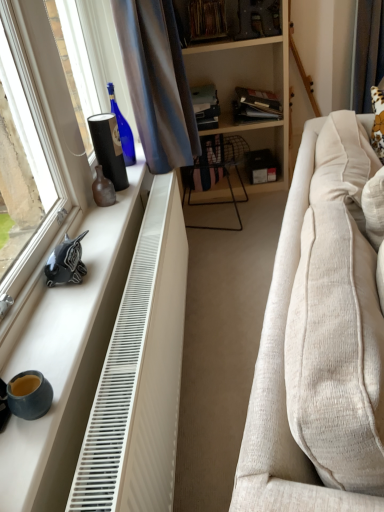
Measure the distance between brown fabric curtain at upper right, acting as the second curtain starting from the front, and camera.

The distance of brown fabric curtain at upper right, acting as the second curtain starting from the front, from camera is 9.74 feet.

Where is `hardcover book at center, which appears as the 1th book when viewed from the left`? This screenshot has width=384, height=512. hardcover book at center, which appears as the 1th book when viewed from the left is located at coordinates (205, 106).

From the picture: In order to face white matte window sill at left, should I rotate leftwards or rightwards?

Rotate your view left by about 12.907°.

The height and width of the screenshot is (512, 384). What do you see at coordinates (103, 189) in the screenshot?
I see `brown matte vase at left` at bounding box center [103, 189].

This screenshot has height=512, width=384. I want to click on brown fabric curtain at upper right, which is the 1th curtain in right-to-left order, so click(367, 53).

From the image's perspective, is brown fabric curtain at upper right, which is the 1th curtain in right-to-left order, above beige fabric couch at right?

Correct, brown fabric curtain at upper right, which is the 1th curtain in right-to-left order, appears higher than beige fabric couch at right in the image.

Is brown fabric curtain at upper right, acting as the second curtain starting from the front, turned away from beige fabric couch at right?

brown fabric curtain at upper right, acting as the second curtain starting from the front, is not turned away from beige fabric couch at right.

Is the depth of brown fabric curtain at upper right, which is the second curtain from left to right, greater than that of beige fabric couch at right?

Yes, brown fabric curtain at upper right, which is the second curtain from left to right, is further from the viewer.

Looking at this image, considering the relative positions of brown matte vase at left and white plastic radiator at lower left in the image provided, is brown matte vase at left to the right of white plastic radiator at lower left from the viewer's perspective?

In fact, brown matte vase at left is to the left of white plastic radiator at lower left.

Between brown matte vase at left and white plastic radiator at lower left, which one has larger size?

Bigger between the two is white plastic radiator at lower left.

Can you tell me how much brown matte vase at left and white plastic radiator at lower left differ in facing direction?

There is a 3.98-degree angle between the facing directions of brown matte vase at left and white plastic radiator at lower left.

Which is behind, brown matte vase at left or white plastic radiator at lower left?

brown matte vase at left is more distant.

From the image's perspective, which is above, hardcover book at center, which appears as the 1th book when viewed from the left, or matte black folder at upper center, positioned as the 3th book in left-to-right order?

matte black folder at upper center, positioned as the 3th book in left-to-right order, is shown above in the image.

What's the angular difference between hardcover book at center, which appears as the 1th book when viewed from the left, and matte black folder at upper center, the 1th book viewed from the right,'s facing directions?

The angular difference between hardcover book at center, which appears as the 1th book when viewed from the left, and matte black folder at upper center, the 1th book viewed from the right, is 0.000143 degrees.

Considering the sizes of objects hardcover book at center, which is counted as the 3th book, starting from the right, and matte black folder at upper center, positioned as the 3th book in left-to-right order, in the image provided, who is wider, hardcover book at center, which is counted as the 3th book, starting from the right, or matte black folder at upper center, positioned as the 3th book in left-to-right order,?

hardcover book at center, which is counted as the 3th book, starting from the right.

Does hardcover book at center, which is counted as the 3th book, starting from the right, touch black glossy unicorn at left?

There is a gap between hardcover book at center, which is counted as the 3th book, starting from the right, and black glossy unicorn at left.

Between hardcover book at center, which appears as the 1th book when viewed from the left, and black glossy unicorn at left, which one appears on the right side from the viewer's perspective?

hardcover book at center, which appears as the 1th book when viewed from the left, is more to the right.

Considering the relative sizes of hardcover book at center, which appears as the 1th book when viewed from the left, and black glossy unicorn at left in the image provided, is hardcover book at center, which appears as the 1th book when viewed from the left, smaller than black glossy unicorn at left?

No, hardcover book at center, which appears as the 1th book when viewed from the left, is not smaller than black glossy unicorn at left.

From a real-world perspective, who is located lower, hardcover book at center, which appears as the 1th book when viewed from the left, or black glossy unicorn at left?

In real-world perspective, hardcover book at center, which appears as the 1th book when viewed from the left, is lower.

Is matte black folder at upper center, the 1th book viewed from the right, facing towards hardcover book at center, which appears as the 1th book when viewed from the left?

No, matte black folder at upper center, the 1th book viewed from the right, is not oriented towards hardcover book at center, which appears as the 1th book when viewed from the left.

From a real-world perspective, does matte black folder at upper center, positioned as the 3th book in left-to-right order, sit lower than hardcover book at center, which is counted as the 3th book, starting from the right?

Yes, from a real-world perspective, matte black folder at upper center, positioned as the 3th book in left-to-right order, is beneath hardcover book at center, which is counted as the 3th book, starting from the right.

Considering the relative positions of matte black folder at upper center, the 1th book viewed from the right, and hardcover book at center, which appears as the 1th book when viewed from the left, in the image provided, is matte black folder at upper center, the 1th book viewed from the right, to the right of hardcover book at center, which appears as the 1th book when viewed from the left, from the viewer's perspective?

Correct, you'll find matte black folder at upper center, the 1th book viewed from the right, to the right of hardcover book at center, which appears as the 1th book when viewed from the left.

Consider the image. Looking at the image, does matte blue coffee cup at lower left seem bigger or smaller compared to matte black folder at upper center, positioned as the 3th book in left-to-right order?

In the image, matte blue coffee cup at lower left appears to be smaller than matte black folder at upper center, positioned as the 3th book in left-to-right order.

Measure the distance from matte blue coffee cup at lower left to matte black folder at upper center, the 1th book viewed from the right.

They are 8.32 feet apart.

From the image's perspective, is matte blue coffee cup at lower left above or below matte black folder at upper center, the 1th book viewed from the right?

From the image's perspective, matte blue coffee cup at lower left appears below matte black folder at upper center, the 1th book viewed from the right.

Considering the sizes of matte blue coffee cup at lower left and matte black folder at upper center, the 1th book viewed from the right, in the image, is matte blue coffee cup at lower left taller or shorter than matte black folder at upper center, the 1th book viewed from the right,?

matte blue coffee cup at lower left is shorter than matte black folder at upper center, the 1th book viewed from the right.

Are beige fabric couch at right and black glossy unicorn at left making contact?

beige fabric couch at right and black glossy unicorn at left are clearly separated.

Considering the sizes of beige fabric couch at right and black glossy unicorn at left in the image, is beige fabric couch at right taller or shorter than black glossy unicorn at left?

Clearly, beige fabric couch at right is taller compared to black glossy unicorn at left.

Looking at this image, which is more to the left, beige fabric couch at right or black glossy unicorn at left?

Answer: black glossy unicorn at left is more to the left.

Where is `curtain that is the 2nd object located behind the beige fabric couch at right`? This screenshot has width=384, height=512. curtain that is the 2nd object located behind the beige fabric couch at right is located at coordinates (367, 53).

Find the location of `vase above the white plastic radiator at lower left (from a real-world perspective)`. vase above the white plastic radiator at lower left (from a real-world perspective) is located at coordinates (103, 189).

Estimate the real-world distances between objects in this image. Which object is further from satin blue curtain at upper left, which is the first curtain in front-to-back order, beige fabric couch at right or brown fabric curtain at upper right, acting as the second curtain starting from the front?

brown fabric curtain at upper right, acting as the second curtain starting from the front, is positioned further to the anchor satin blue curtain at upper left, which is the first curtain in front-to-back order.

Looking at the image, which one is located closer to brown matte vase at left, matte blue coffee cup at lower left or hardcover book at center, which is counted as the 3th book, starting from the right?

Among the two, matte blue coffee cup at lower left is located nearer to brown matte vase at left.

Looking at the image, which one is located further to brown fabric curtain at upper right, acting as the second curtain starting from the front, brown matte vase at left or hardcover book at center, which is counted as the 3th book, starting from the right?

brown matte vase at left lies further to brown fabric curtain at upper right, acting as the second curtain starting from the front, than the other object.

Which object lies further to the anchor point black glossy unicorn at left, beige fabric couch at right or brown matte vase at left?

beige fabric couch at right is positioned further to the anchor black glossy unicorn at left.

When comparing their distances from beige fabric couch at right, does white plastic radiator at lower left or brown fabric curtain at upper right, acting as the second curtain starting from the front, seem further?

Based on the image, brown fabric curtain at upper right, acting as the second curtain starting from the front, appears to be further to beige fabric couch at right.

From the picture: Based on their spatial positions, is satin blue curtain at upper left, the second curtain viewed from the right, or matte blue coffee cup at lower left further from white plastic radiator at lower left?

satin blue curtain at upper left, the second curtain viewed from the right, lies further to white plastic radiator at lower left than the other object.

Based on their spatial positions, is hardcover book at center, which is counted as the 3th book, starting from the right, or white matte window sill at left further from white plastic radiator at lower left?

Among the two, hardcover book at center, which is counted as the 3th book, starting from the right, is located further to white plastic radiator at lower left.

From the image, which object appears to be farther from matte black folder at upper center, the 1th book viewed from the right, white matte window sill at left or black glossy unicorn at left?

black glossy unicorn at left is further to matte black folder at upper center, the 1th book viewed from the right.

This screenshot has width=384, height=512. Identify the location of window sill between satin blue curtain at upper left, the second curtain viewed from the right, and matte blue coffee cup at lower left from top to bottom. (68, 351).

The image size is (384, 512). What are the coordinates of `curtain between matte blue coffee cup at lower left and matte black folder at upper center, the 1th book viewed from the right, from front to back` in the screenshot? It's located at (157, 83).

Find the location of a particular element. Image resolution: width=384 pixels, height=512 pixels. curtain between matte blue coffee cup at lower left and hardcover book at center, which is counted as the 3th book, starting from the right, in the front-back direction is located at coordinates tap(157, 83).

Where is `radiator between beige fabric couch at right and satin blue curtain at upper left, which ranks as the 1th curtain in left-to-right order, along the z-axis`? radiator between beige fabric couch at right and satin blue curtain at upper left, which ranks as the 1th curtain in left-to-right order, along the z-axis is located at coordinates pos(140,374).